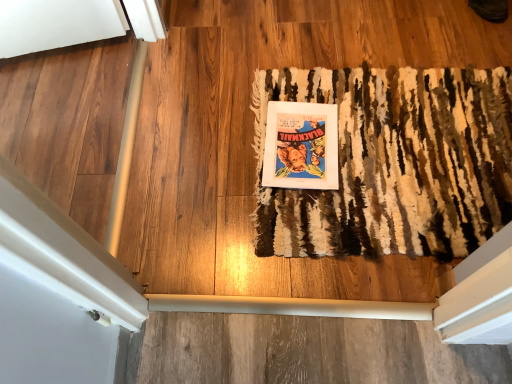
I want to click on vacant space behind rug at center, so click(x=329, y=33).